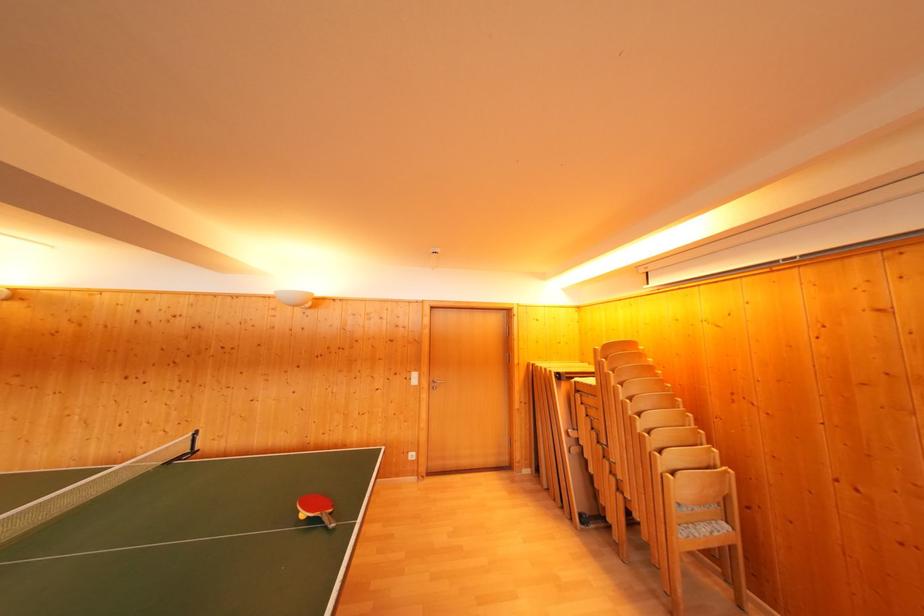
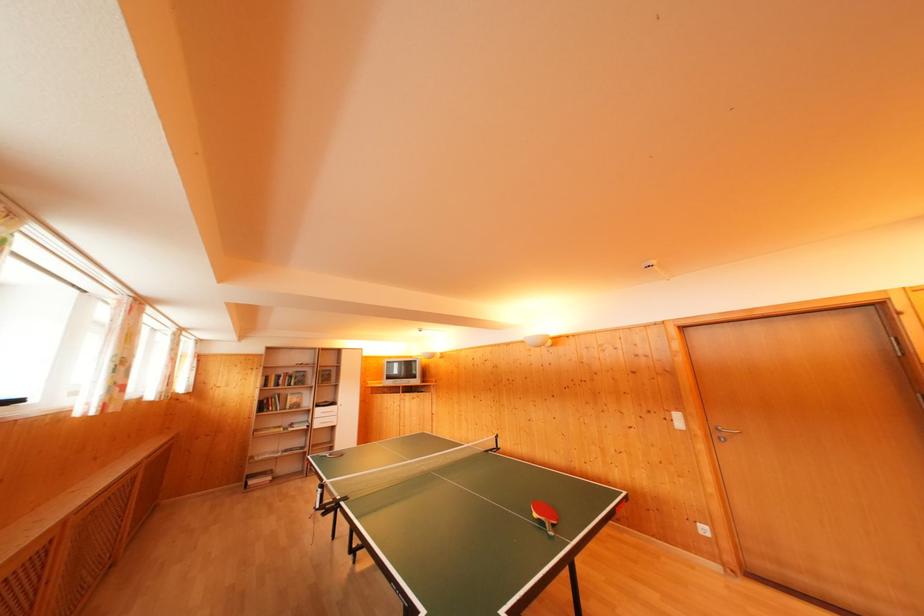
In the second image, find the point that corresponds to pixel 436 392 in the first image.

(718, 440)